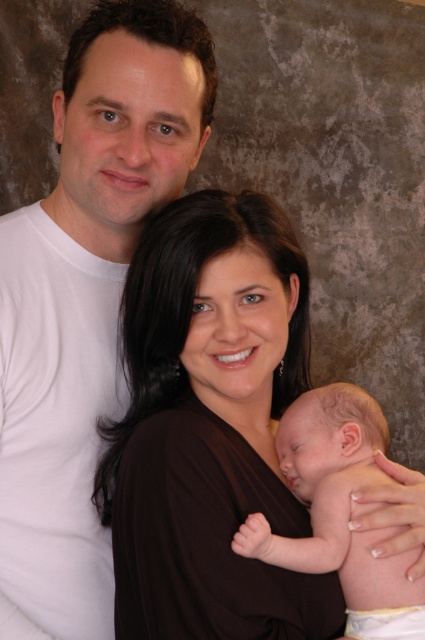
Question: Which point is closer to the camera taking this photo?

Choices:
 (A) (25, 330)
 (B) (306, 412)
 (C) (235, 275)

Answer: (C)

Question: Which is nearer to the brown matte dress at center?

Choices:
 (A) smooth skin baby at center
 (B) white matte t-shirt at upper left

Answer: (A)

Question: Is brown matte dress at center closer to the viewer compared to smooth skin baby at center?

Choices:
 (A) yes
 (B) no

Answer: (A)

Question: Which object is positioned farthest from the brown matte dress at center?

Choices:
 (A) smooth skin baby at center
 (B) white matte t-shirt at upper left

Answer: (B)

Question: Does brown matte dress at center lie in front of smooth skin baby at center?

Choices:
 (A) no
 (B) yes

Answer: (B)

Question: Observing the image, what is the correct spatial positioning of brown matte dress at center in reference to white matte t-shirt at upper left?

Choices:
 (A) below
 (B) above

Answer: (A)